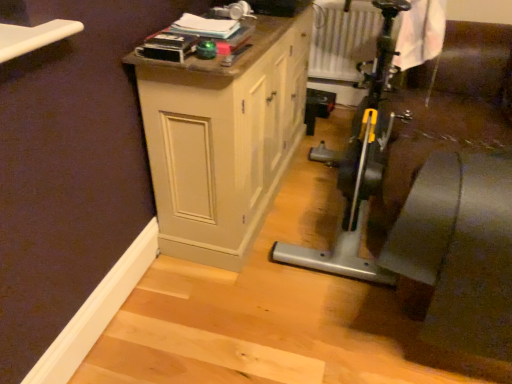
Question: From the image's perspective, relative to matte wood cabinet at center, is white textured radiator at upper center above or below?

Choices:
 (A) below
 (B) above

Answer: (B)

Question: Considering the positions of white textured radiator at upper center and matte wood cabinet at center in the image, is white textured radiator at upper center wider or thinner than matte wood cabinet at center?

Choices:
 (A) wide
 (B) thin

Answer: (B)

Question: In terms of height, does white textured radiator at upper center look taller or shorter compared to matte wood cabinet at center?

Choices:
 (A) tall
 (B) short

Answer: (B)

Question: From their relative heights in the image, would you say matte wood cabinet at center is taller or shorter than white textured radiator at upper center?

Choices:
 (A) tall
 (B) short

Answer: (A)

Question: Is matte wood cabinet at center inside the boundaries of white textured radiator at upper center, or outside?

Choices:
 (A) outside
 (B) inside

Answer: (A)

Question: From a real-world perspective, is matte wood cabinet at center physically located above or below white textured radiator at upper center?

Choices:
 (A) below
 (B) above

Answer: (A)

Question: From the image's perspective, is matte wood cabinet at center located above or below white textured radiator at upper center?

Choices:
 (A) below
 (B) above

Answer: (A)